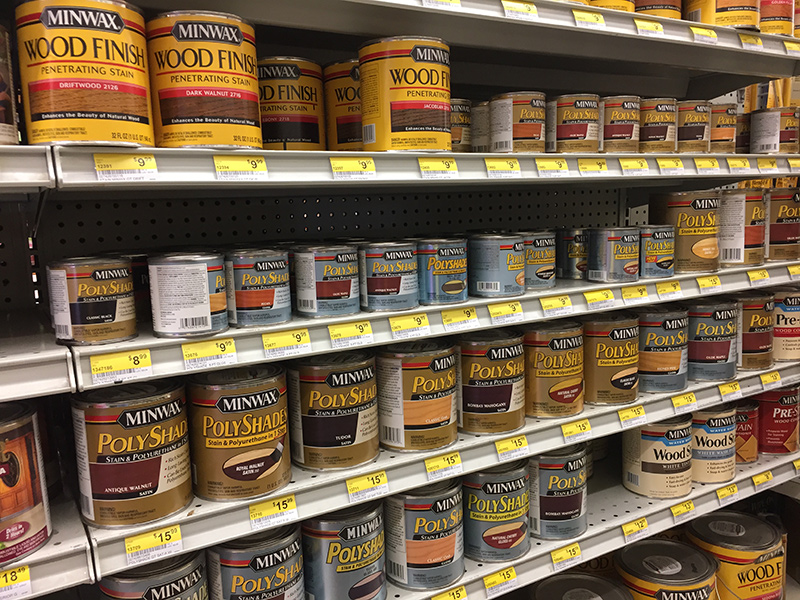
At what (x,y) coordinates should I click in order to perform the action: click on shelves. Please return your answer as a coordinate pair (x, y). The image size is (800, 600). Looking at the image, I should click on (305, 166), (322, 333), (333, 501), (484, 592).